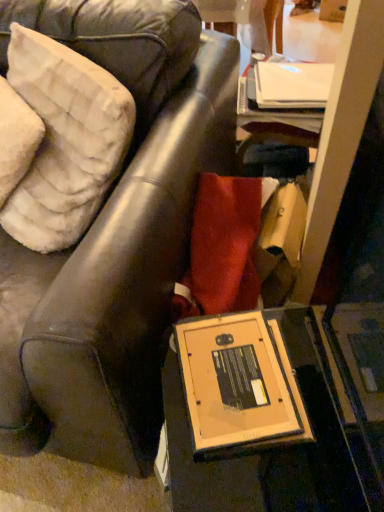
This screenshot has height=512, width=384. What do you see at coordinates (16, 139) in the screenshot?
I see `white fluffy pillow at upper left, the first pillow viewed from the left` at bounding box center [16, 139].

Where is `white plush pillow at upper left, which is the 1th pillow from right to left`? The width and height of the screenshot is (384, 512). white plush pillow at upper left, which is the 1th pillow from right to left is located at coordinates (65, 140).

This screenshot has height=512, width=384. I want to click on pillow beneath the white plush pillow at upper left, which is the 1th pillow from right to left (from a real-world perspective), so click(x=16, y=139).

From the picture: From the image's perspective, is white fluffy pillow at upper left, the first pillow viewed from the left, located above or below white plush pillow at upper left, which is the 1th pillow from right to left?

white fluffy pillow at upper left, the first pillow viewed from the left, is below white plush pillow at upper left, which is the 1th pillow from right to left.

Is white fluffy pillow at upper left, the second pillow when ordered from right to left, oriented away from white plush pillow at upper left, the second pillow in the left-to-right sequence?

Correct, white fluffy pillow at upper left, the second pillow when ordered from right to left, is looking away from white plush pillow at upper left, the second pillow in the left-to-right sequence.

Is white fluffy pillow at upper left, the second pillow when ordered from right to left, shorter than white plush pillow at upper left, the second pillow in the left-to-right sequence?

Yes, white fluffy pillow at upper left, the second pillow when ordered from right to left, is shorter than white plush pillow at upper left, the second pillow in the left-to-right sequence.

From the image's perspective, between white fluffy pillow at upper left, the first pillow viewed from the left, and matte brown leather chair at center, which one is located above?

white fluffy pillow at upper left, the first pillow viewed from the left, is shown above in the image.

Measure the distance between white fluffy pillow at upper left, the first pillow viewed from the left, and matte brown leather chair at center.

A distance of 15.24 inches exists between white fluffy pillow at upper left, the first pillow viewed from the left, and matte brown leather chair at center.

Based on their sizes in the image, would you say white fluffy pillow at upper left, the second pillow when ordered from right to left, is bigger or smaller than matte brown leather chair at center?

Considering their sizes, white fluffy pillow at upper left, the second pillow when ordered from right to left, takes up less space than matte brown leather chair at center.

Is point (24, 151) positioned before point (142, 187)?

No.

Find the location of `pillow in front of the white fluffy pillow at upper left, the first pillow viewed from the left`. pillow in front of the white fluffy pillow at upper left, the first pillow viewed from the left is located at coordinates (65, 140).

Does white plush pillow at upper left, the second pillow in the left-to-right sequence, touch white fluffy pillow at upper left, the first pillow viewed from the left?

Indeed, white plush pillow at upper left, the second pillow in the left-to-right sequence, and white fluffy pillow at upper left, the first pillow viewed from the left, are beside each other and touching.

Does white plush pillow at upper left, the second pillow in the left-to-right sequence, have a smaller size compared to white fluffy pillow at upper left, the first pillow viewed from the left?

No.

From the image's perspective, is white plush pillow at upper left, the second pillow in the left-to-right sequence, above or below white fluffy pillow at upper left, the first pillow viewed from the left?

white plush pillow at upper left, the second pillow in the left-to-right sequence, is above white fluffy pillow at upper left, the first pillow viewed from the left.

From the image's perspective, which is above, matte brown leather chair at center or white plush pillow at upper left, which is the 1th pillow from right to left?

white plush pillow at upper left, which is the 1th pillow from right to left.

How different are the orientations of matte brown leather chair at center and white plush pillow at upper left, the second pillow in the left-to-right sequence, in degrees?

They differ by 31.5 degrees in their facing directions.

Locate an element on the screen. chair that is on the left side of white plush pillow at upper left, which is the 1th pillow from right to left is located at coordinates click(116, 246).

Is point (58, 19) positioned before point (65, 190)?

No, it is not.

From a real-world perspective, is matte brown leather chair at center positioned above or below white fluffy pillow at upper left, the second pillow when ordered from right to left?

In terms of real-world spatial position, matte brown leather chair at center is below white fluffy pillow at upper left, the second pillow when ordered from right to left.

From the picture: Between matte brown leather chair at center and white fluffy pillow at upper left, the second pillow when ordered from right to left, which one has larger width?

matte brown leather chair at center.

Is matte brown leather chair at center to the right of white fluffy pillow at upper left, the second pillow when ordered from right to left, from the viewer's perspective?

In fact, matte brown leather chair at center is to the left of white fluffy pillow at upper left, the second pillow when ordered from right to left.

At what (x,y) coordinates should I click in order to perform the action: click on chair in front of the white plush pillow at upper left, which is the 1th pillow from right to left. Please return your answer as a coordinate pair (x, y). Looking at the image, I should click on (116, 246).

Is white plush pillow at upper left, the second pillow in the left-to-right sequence, wider than matte brown leather chair at center?

No.

From a real-world perspective, is white plush pillow at upper left, which is the 1th pillow from right to left, located higher than matte brown leather chair at center?

Indeed, from a real-world perspective, white plush pillow at upper left, which is the 1th pillow from right to left, stands above matte brown leather chair at center.

Could matte brown leather chair at center be considered to be inside white plush pillow at upper left, which is the 1th pillow from right to left?

No.

You are a GUI agent. You are given a task and a screenshot of the screen. Output one action in this format:
    pyautogui.click(x=<x>, y=<y>)
    Task: Click on the pillow that is on the left side of white plush pillow at upper left, the second pillow in the left-to-right sequence
    Image resolution: width=384 pixels, height=512 pixels.
    Given the screenshot: What is the action you would take?
    pyautogui.click(x=16, y=139)

Starting from the matte brown leather chair at center, which pillow is the 2nd one behind? Please provide its 2D coordinates.

[(16, 139)]

When comparing their distances from white plush pillow at upper left, the second pillow in the left-to-right sequence, does matte brown leather chair at center or white fluffy pillow at upper left, the first pillow viewed from the left, seem further?

matte brown leather chair at center is positioned further to the anchor white plush pillow at upper left, the second pillow in the left-to-right sequence.

Based on their spatial positions, is white plush pillow at upper left, which is the 1th pillow from right to left, or matte brown leather chair at center further from white fluffy pillow at upper left, the first pillow viewed from the left?

matte brown leather chair at center.

Based on their spatial positions, is white fluffy pillow at upper left, the first pillow viewed from the left, or white plush pillow at upper left, which is the 1th pillow from right to left, closer to matte brown leather chair at center?

white plush pillow at upper left, which is the 1th pillow from right to left, lies closer to matte brown leather chair at center than the other object.

From the picture: Based on their spatial positions, is white plush pillow at upper left, the second pillow in the left-to-right sequence, or white fluffy pillow at upper left, the first pillow viewed from the left, closer to matte brown leather chair at center?

white plush pillow at upper left, the second pillow in the left-to-right sequence, is positioned closer to the anchor matte brown leather chair at center.

Considering their positions, is matte brown leather chair at center positioned further to white fluffy pillow at upper left, the second pillow when ordered from right to left, than white plush pillow at upper left, the second pillow in the left-to-right sequence?

Among the two, matte brown leather chair at center is located further to white fluffy pillow at upper left, the second pillow when ordered from right to left.

When comparing their distances from white plush pillow at upper left, the second pillow in the left-to-right sequence, does white fluffy pillow at upper left, the second pillow when ordered from right to left, or matte brown leather chair at center seem closer?

The object closer to white plush pillow at upper left, the second pillow in the left-to-right sequence, is white fluffy pillow at upper left, the second pillow when ordered from right to left.

Where is `pillow positioned between matte brown leather chair at center and white fluffy pillow at upper left, the second pillow when ordered from right to left, from near to far`? This screenshot has width=384, height=512. pillow positioned between matte brown leather chair at center and white fluffy pillow at upper left, the second pillow when ordered from right to left, from near to far is located at coordinates (65, 140).